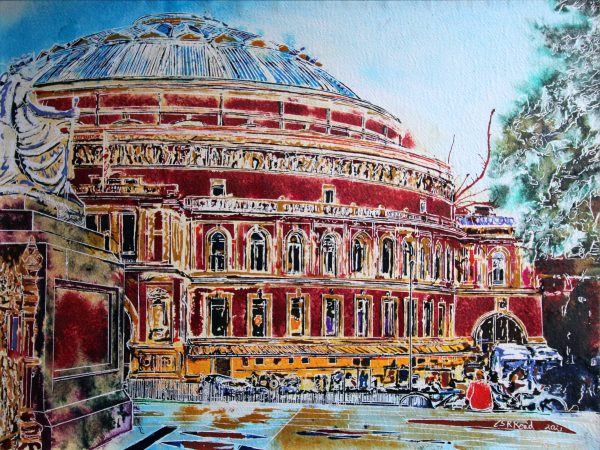
Identify the location of two rows of windows. (222, 315), (267, 244).